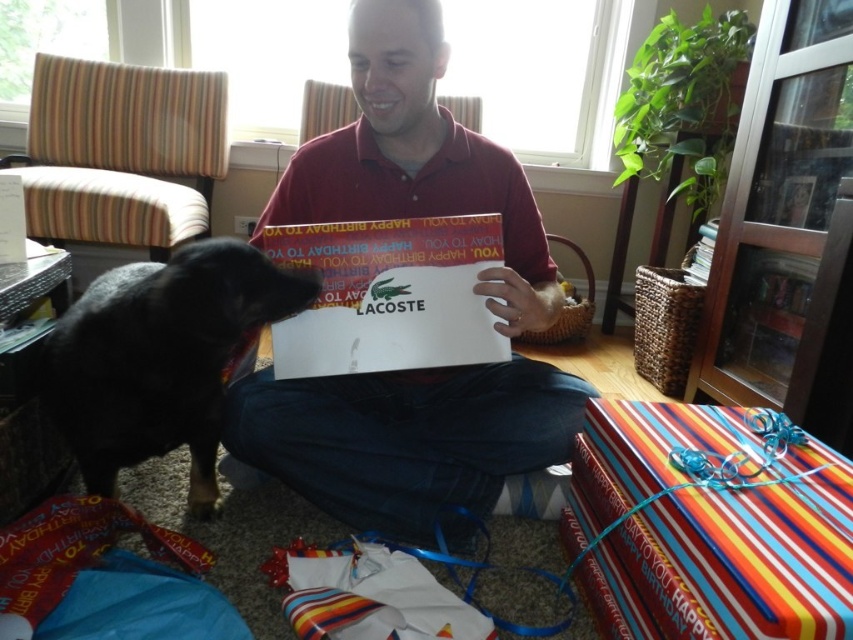
Question: Which is nearer to the black fur dog at left?

Choices:
 (A) striped paper gift at lower right
 (B) matte red shirt at center

Answer: (B)

Question: Is dark blue fabric at center below black fur dog at left?

Choices:
 (A) yes
 (B) no

Answer: (A)

Question: Among these points, which one is farthest from the camera?

Choices:
 (A) 676,552
 (B) 109,440
 (C) 329,176
 (D) 317,428

Answer: (C)

Question: Among these objects, which one is nearest to the camera?

Choices:
 (A) matte red shirt at center
 (B) black fur dog at left
 (C) striped paper gift at lower right

Answer: (C)

Question: Can you confirm if striped paper gift at lower right is positioned to the left of black fur dog at left?

Choices:
 (A) no
 (B) yes

Answer: (A)

Question: Is striped paper gift at lower right bigger than black fur dog at left?

Choices:
 (A) no
 (B) yes

Answer: (A)